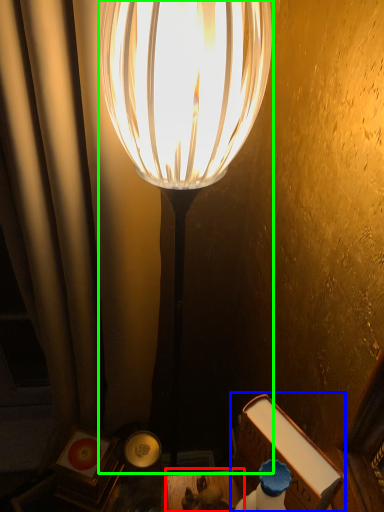
Question: Considering the real-world distances, which object is closest to table (highlighted by a red box)? book (highlighted by a blue box) or lamp (highlighted by a green box).

Choices:
 (A) book
 (B) lamp

Answer: (A)